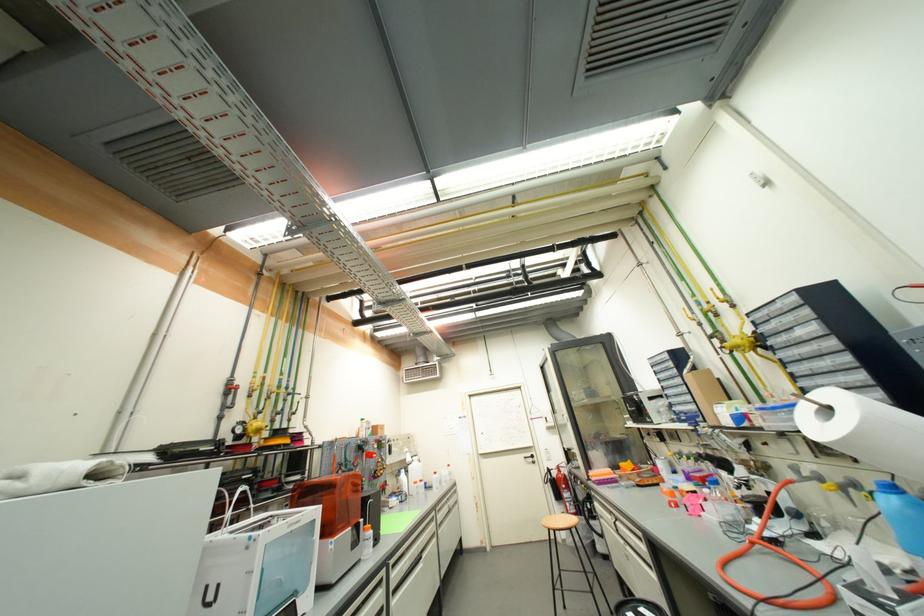
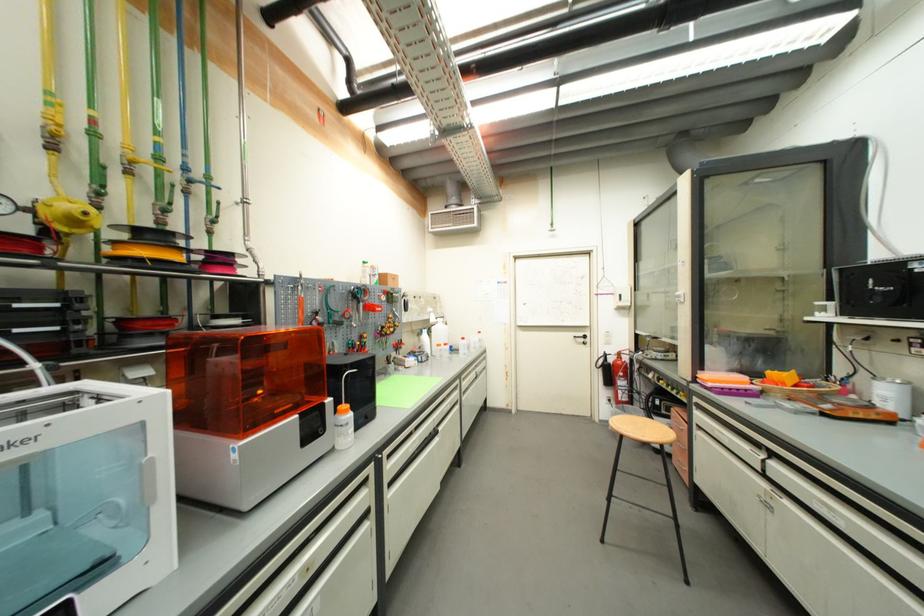
The point at (350,446) is marked in the first image. Where is the corresponding point in the second image?

(334, 289)